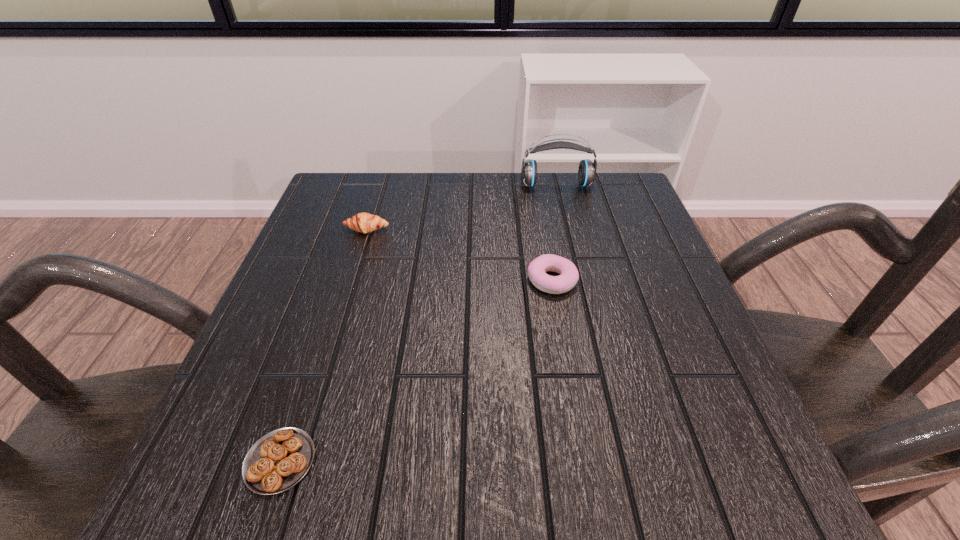
The width and height of the screenshot is (960, 540). What are the coordinates of `vacant region between the farthest pastry and the farthest object` in the screenshot? It's located at (462, 207).

You are a GUI agent. You are given a task and a screenshot of the screen. Output one action in this format:
    pyautogui.click(x=<x>, y=<y>)
    Task: Click on the free spot between the second farthest pastry and the nearest object
    The width and height of the screenshot is (960, 540).
    Given the screenshot: What is the action you would take?
    pyautogui.click(x=416, y=371)

The height and width of the screenshot is (540, 960). What are the coordinates of `free space between the rightmost pastry and the headset` in the screenshot? It's located at (554, 233).

Find the location of a particular element. The height and width of the screenshot is (540, 960). vacant area between the shortest pastry and the rightmost pastry is located at coordinates (416, 371).

This screenshot has width=960, height=540. What are the coordinates of `object that stands as the second closest to the rightmost pastry` in the screenshot? It's located at tap(362, 222).

Locate an element on the screen. The width and height of the screenshot is (960, 540). object that is the third closest one to the third nearest object is located at coordinates (280, 459).

Choose which pastry is the second nearest neighbor to the headset. Please provide its 2D coordinates. Your answer should be formatted as a tuple, i.e. [(x, y)], where the tuple contains the x and y coordinates of a point satisfying the conditions above.

[(362, 222)]

Image resolution: width=960 pixels, height=540 pixels. I want to click on pastry object that ranks as the second closest to the farthest pastry, so click(280, 459).

Find the location of a particular element. The width and height of the screenshot is (960, 540). vacant region that satisfies the following two spatial constraints: 1. on the front-facing side of the second farthest object; 2. on the right side of the rightmost pastry is located at coordinates (351, 281).

Locate an element on the screen. This screenshot has height=540, width=960. free space that satisfies the following two spatial constraints: 1. on the back side of the third farthest object; 2. on the left side of the nearest object is located at coordinates (341, 281).